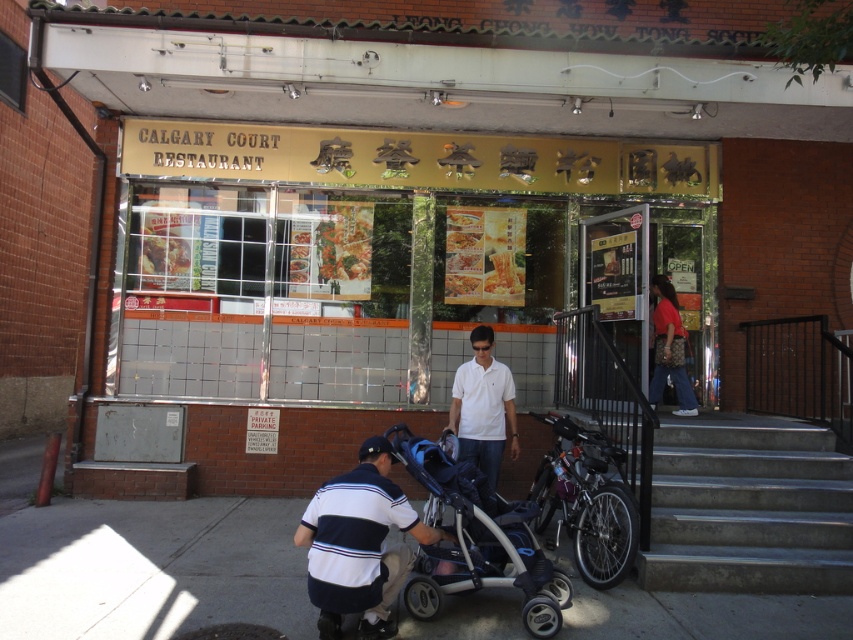
Is white striped shirt at lower center positioned behind white matte shirt at center?

No, white striped shirt at lower center is in front of white matte shirt at center.

Who is positioned more to the left, white striped shirt at lower center or white matte shirt at center?

From the viewer's perspective, white striped shirt at lower center appears more on the left side.

Where is `white striped shirt at lower center`? white striped shirt at lower center is located at coordinates (358, 545).

Which is more to the right, black textured stroller at center or white matte shirt at center?

From the viewer's perspective, white matte shirt at center appears more on the right side.

Can you confirm if black textured stroller at center is thinner than white matte shirt at center?

No, black textured stroller at center is not thinner than white matte shirt at center.

Is point (523, 572) behind point (463, 364)?

That is False.

Identify the location of black textured stroller at center. The image size is (853, 640). (477, 540).

Who is shorter, white matte shirt at center or matte red shirt at entrance?

white matte shirt at center

What do you see at coordinates (483, 406) in the screenshot? I see `white matte shirt at center` at bounding box center [483, 406].

Find the location of `white matte shirt at center`. white matte shirt at center is located at coordinates (483, 406).